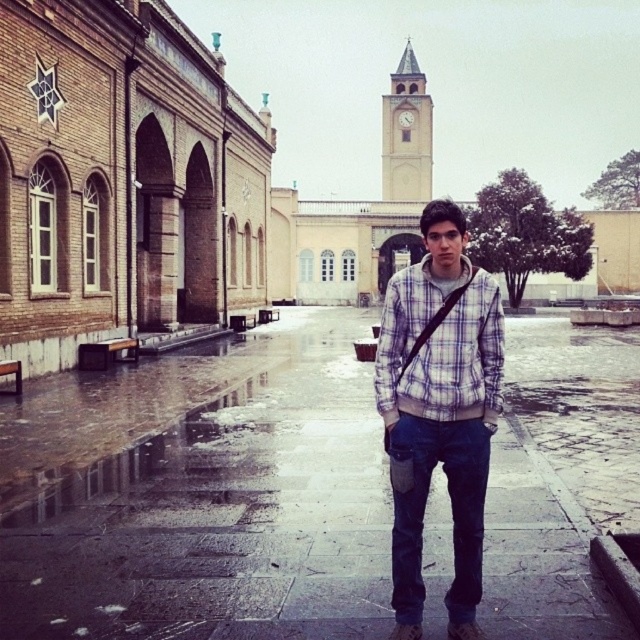
Question: Is plaid cotton shirt at center thinner than plaid fabric shirt at center?

Choices:
 (A) no
 (B) yes

Answer: (B)

Question: Can you confirm if plaid fabric shirt at center is thinner than light beige stone clock tower at upper center?

Choices:
 (A) yes
 (B) no

Answer: (A)

Question: Based on their relative distances, which object is nearer to the wet concrete pavement at center?

Choices:
 (A) light beige stone clock tower at upper center
 (B) plaid cotton shirt at center
 (C) plaid fabric shirt at center

Answer: (B)

Question: Based on their relative distances, which object is nearer to the light beige stone clock tower at upper center?

Choices:
 (A) plaid fabric shirt at center
 (B) wet concrete pavement at center

Answer: (B)

Question: Considering the real-world distances, which object is closest to the light beige stone clock tower at upper center?

Choices:
 (A) wet concrete pavement at center
 (B) plaid cotton shirt at center
 (C) plaid fabric shirt at center

Answer: (A)

Question: Is the position of plaid cotton shirt at center less distant than that of light beige stone clock tower at upper center?

Choices:
 (A) yes
 (B) no

Answer: (A)